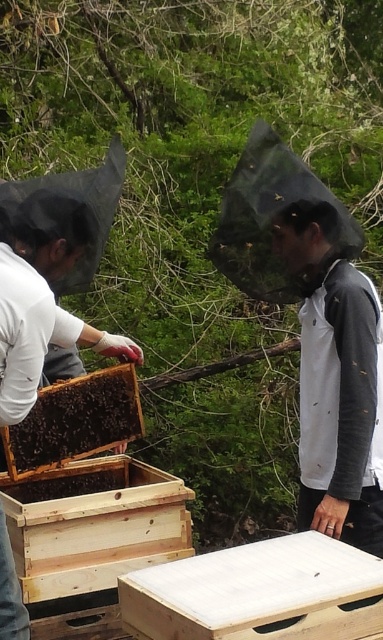
Is white matte jacket at center above dark brown wooden beehive at center?

Yes.

Which of these two, white matte jacket at center or dark brown wooden beehive at center, stands shorter?

With less height is dark brown wooden beehive at center.

The height and width of the screenshot is (640, 383). Identify the location of white matte jacket at center. (335, 381).

Find the location of a particular element. Image resolution: width=383 pixels, height=640 pixels. white matte jacket at center is located at coordinates (335, 381).